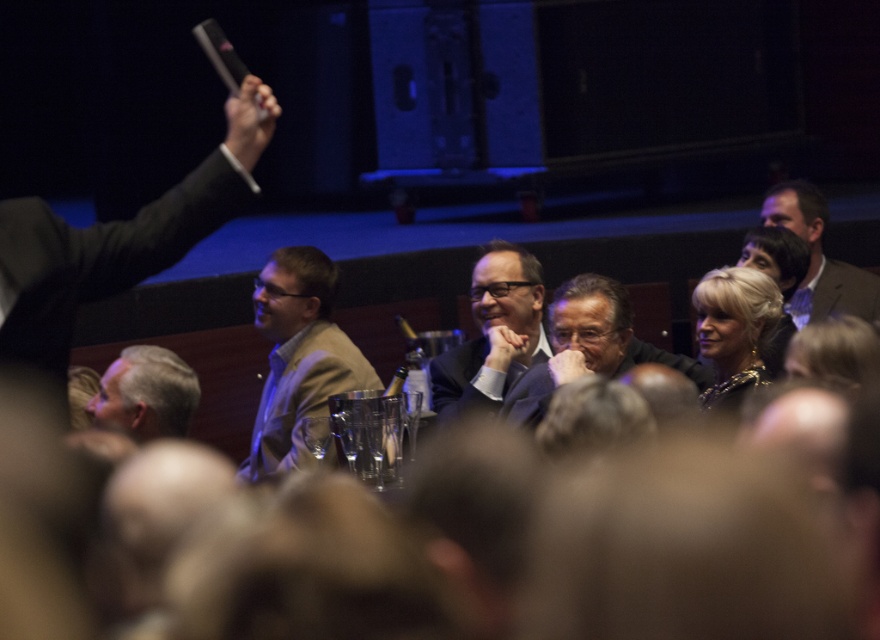
From the picture: You are standing at the center of the auditorium and see the point marked at coordinates (116, 243). What is the object located at that point?

The point at coordinates (116, 243) marks the location of the matte black suit at left.

You are an event planner arranging seating for a photo opportunity. You need to place a chair that is 18 inches wide between the matte beige jacket at center and the matte black suit at center. Based on their widths, will there be enough space for the chair between them?

The matte beige jacket at center might be wider than the matte black suit at center, but since the exact width difference isn

You are an event planner at the theater or auditorium. You need to adjust the seating arrangement so that the matte beige jacket at center is no longer under the matte black suit at center. Which object should you move and where?

You should move the matte beige jacket at center to a position above the matte black suit at center.